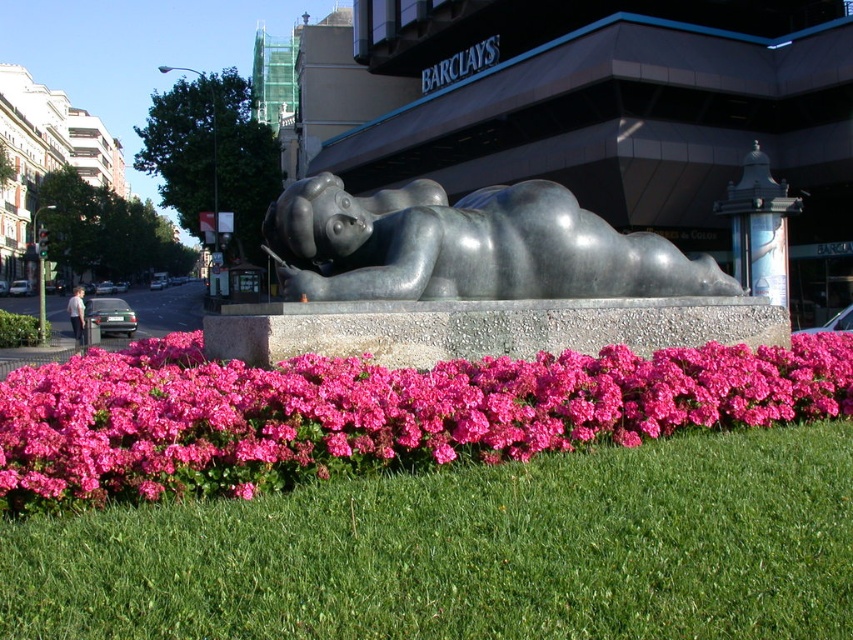
Question: Which of these objects is positioned farthest from the green grass at lower center?

Choices:
 (A) pink matte flowers at center
 (B) polished gray statue at center

Answer: (B)

Question: Does pink matte flowers at center come in front of polished gray statue at center?

Choices:
 (A) no
 (B) yes

Answer: (B)

Question: Observing the image, what is the correct spatial positioning of green grass at lower center in reference to polished gray statue at center?

Choices:
 (A) above
 (B) below

Answer: (B)

Question: Is green grass at lower center above pink matte flowers at center?

Choices:
 (A) yes
 (B) no

Answer: (B)

Question: Which point appears closest to the camera in this image?

Choices:
 (A) (469, 211)
 (B) (91, 547)
 (C) (200, 404)

Answer: (B)

Question: Estimate the real-world distances between objects in this image. Which object is closer to the polished gray statue at center?

Choices:
 (A) green grass at lower center
 (B) pink matte flowers at center

Answer: (B)